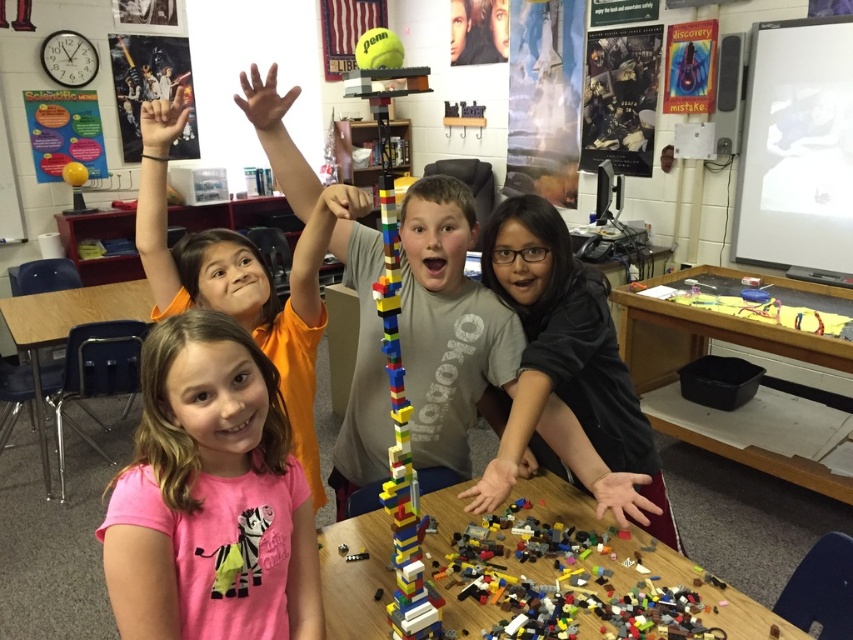
Question: Can you confirm if pink fabric shirt at center is positioned below wooden table at lower right?

Choices:
 (A) yes
 (B) no

Answer: (A)

Question: Which object appears farthest from the camera in this image?

Choices:
 (A) brown wooden table at left
 (B) matte orange shirt at upper left
 (C) smooth skin hand at lower right
 (D) matte black shirt at center

Answer: (A)

Question: Which is nearer to the matte black hand at upper left?

Choices:
 (A) pink fabric shirt at center
 (B) wooden table at lower right
 (C) multicolored plastic lego tower at center

Answer: (A)

Question: Can you confirm if pink fabric shirt at center is thinner than smooth skin hand at lower right?

Choices:
 (A) no
 (B) yes

Answer: (A)

Question: From the image, what is the correct spatial relationship of pink fabric shirt at center in relation to smooth skin hand at lower right?

Choices:
 (A) above
 (B) below

Answer: (A)

Question: Which of the following is the closest to the observer?

Choices:
 (A) (267, 93)
 (B) (229, 595)
 (C) (747, 417)
 (D) (635, 493)

Answer: (B)